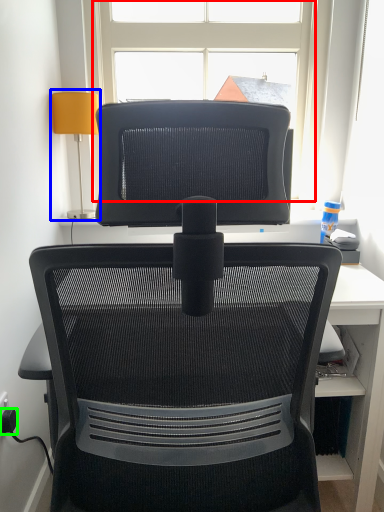
Question: Which object is the closest to the window (highlighted by a red box)? Choose among these: table lamp (highlighted by a blue box) or plug (highlighted by a green box).

Choices:
 (A) table lamp
 (B) plug

Answer: (A)